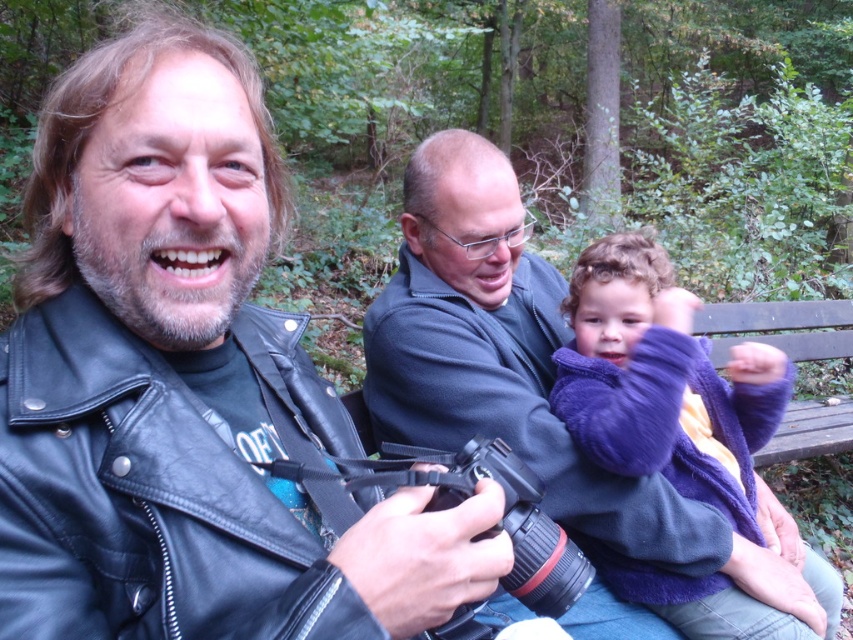
Question: Which point appears closest to the camera in this image?

Choices:
 (A) (828, 616)
 (B) (80, 138)

Answer: (B)

Question: Where is black leather jacket at left located in relation to purple fleece jacket at center in the image?

Choices:
 (A) right
 (B) left

Answer: (B)

Question: Which of these objects is positioned closest to the dark blue fleece at center?

Choices:
 (A) black leather jacket at left
 (B) purple fleece jacket at center

Answer: (B)

Question: Which point is closer to the camera?

Choices:
 (A) dark blue fleece at center
 (B) purple fleece jacket at center
 (C) black leather jacket at left

Answer: (C)

Question: Can you confirm if black leather jacket at left is wider than purple fleece jacket at center?

Choices:
 (A) yes
 (B) no

Answer: (B)

Question: Is dark blue fleece at center bigger than purple fleece jacket at center?

Choices:
 (A) no
 (B) yes

Answer: (B)